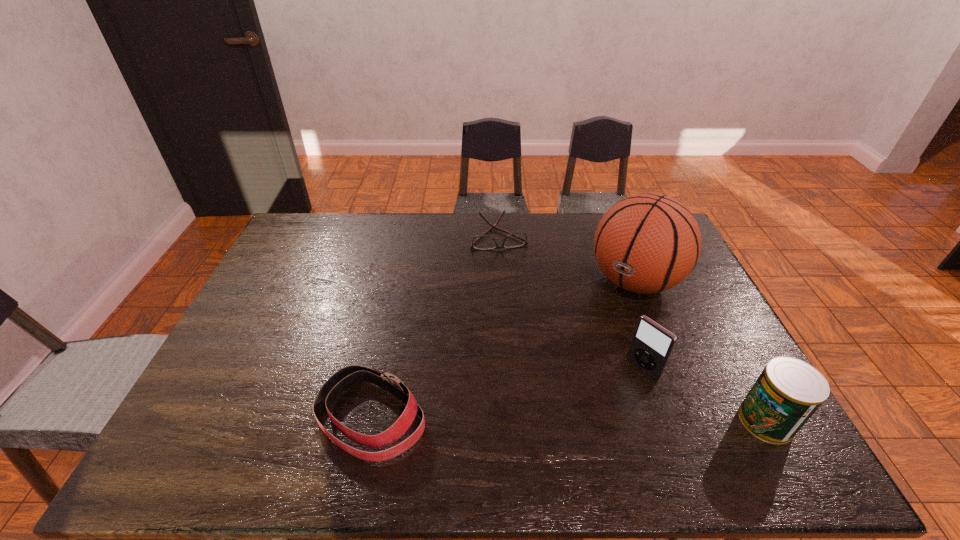
Find the location of `blank space located 0.310m on the front-facing side of the spectacles`. blank space located 0.310m on the front-facing side of the spectacles is located at coordinates (518, 314).

In order to click on vacant space located on the front-facing side of the spectacles in this screenshot , I will do `click(518, 311)`.

The height and width of the screenshot is (540, 960). Identify the location of vacant space located on the front-facing side of the spectacles. (506, 263).

Locate an element on the screen. This screenshot has height=540, width=960. blank area located 0.140m on the front-facing side of the iPod is located at coordinates (600, 407).

What are the coordinates of `blank space located on the front-facing side of the iPod` in the screenshot? It's located at (615, 394).

Find the location of a particular element. The image size is (960, 540). vacant space situated 0.180m on the front-facing side of the iPod is located at coordinates (588, 416).

Image resolution: width=960 pixels, height=540 pixels. Identify the location of vacant space located on the side where the inflation valve is located. (578, 349).

This screenshot has width=960, height=540. Identify the location of vacant space located 0.210m on the side where the inflation valve is located. (578, 349).

The width and height of the screenshot is (960, 540). In order to click on vacant space situated on the side where the inflation valve is located in this screenshot , I will do click(582, 345).

Identify the location of object positioned at the far edge. (518, 239).